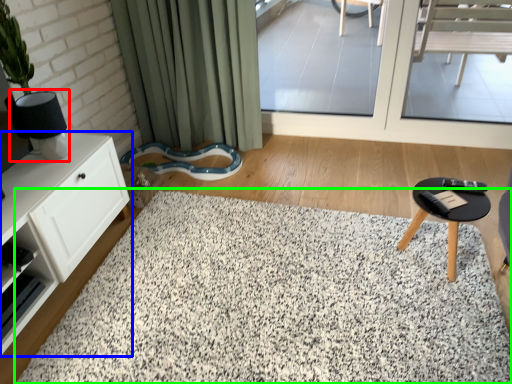
Question: Which object is positioned farthest from lamp (highlighted by a red box)? Select from cabinetry (highlighted by a blue box) and mat (highlighted by a green box).

Choices:
 (A) cabinetry
 (B) mat

Answer: (B)